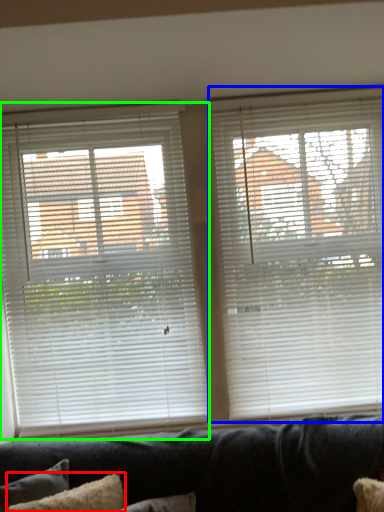
Question: Which object is positioned farthest from pillow (highlighted by a red box)? Select from window blind (highlighted by a blue box) and window blind (highlighted by a green box).

Choices:
 (A) window blind
 (B) window blind

Answer: (A)